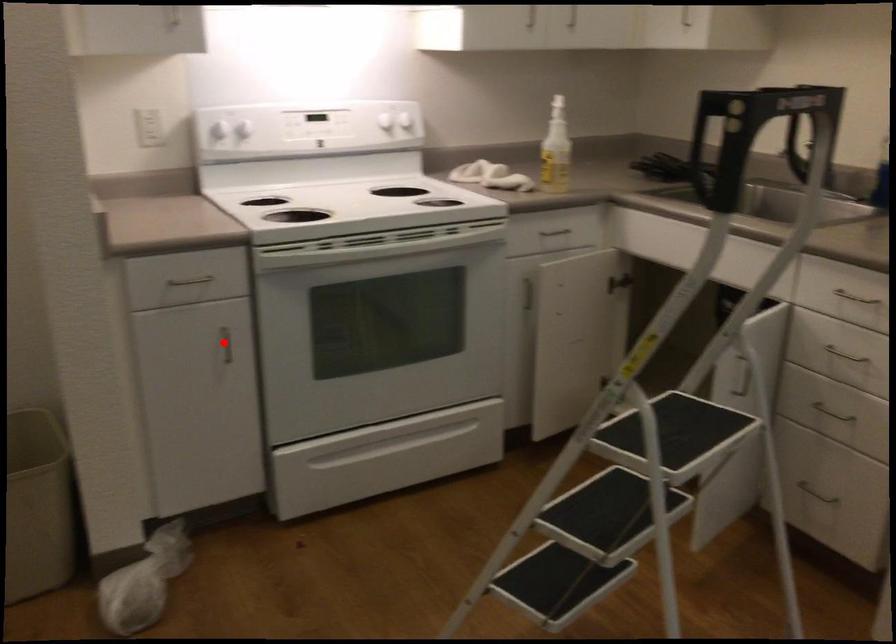
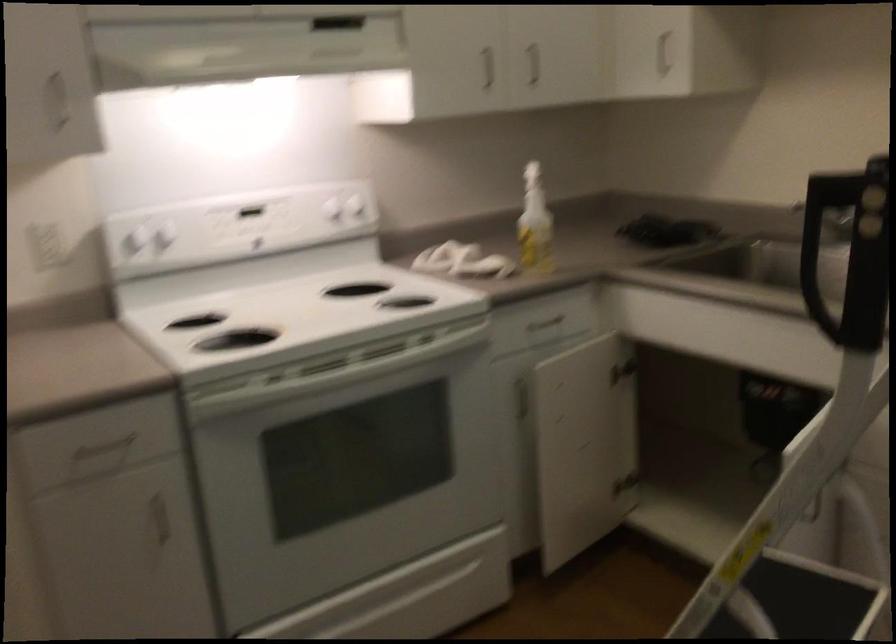
Question: I am providing you with two images of the same scene from different viewpoints. A red point is shown in image1. For the corresponding object point in image2, is it positioned nearer or farther from the camera?

Choices:
 (A) Nearer
 (B) Farther

Answer: (A)